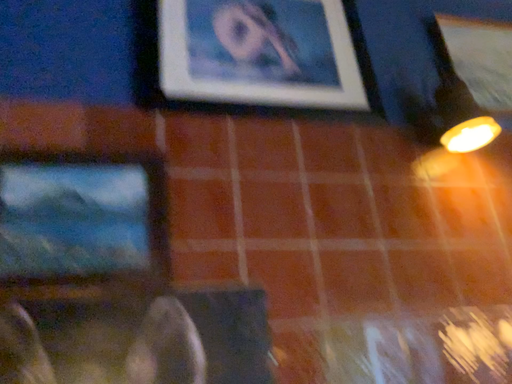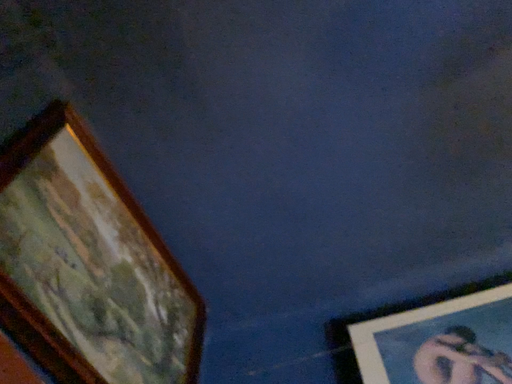
Question: How did the camera likely rotate when shooting the video?

Choices:
 (A) rotated left
 (B) rotated right

Answer: (A)